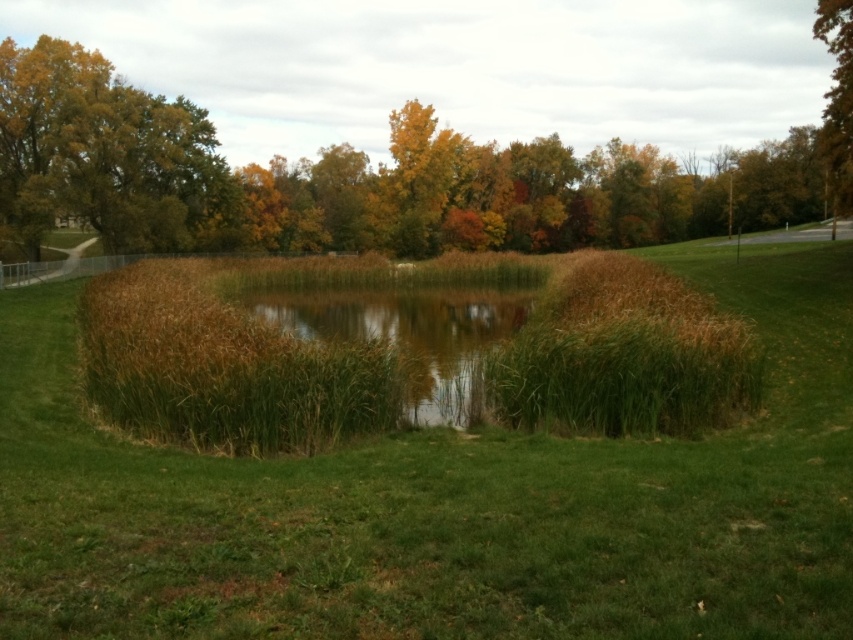
This screenshot has width=853, height=640. Identify the location of green grassy golf course at center. (445, 502).

Can you confirm if green grassy golf course at center is shorter than brown grassy lake at center?

Indeed, green grassy golf course at center has a lesser height compared to brown grassy lake at center.

Where is `green grassy golf course at center`? The height and width of the screenshot is (640, 853). green grassy golf course at center is located at coordinates (445, 502).

Which is more to the right, green leafy tree at upper center or green leafy tree at upper left?

Positioned to the right is green leafy tree at upper center.

This screenshot has height=640, width=853. I want to click on green leafy tree at upper center, so tap(352, 179).

Does point (816, 211) come behind point (171, 134)?

Yes, it is.

At what (x,y) coordinates should I click in order to perform the action: click on green leafy tree at upper center. Please return your answer as a coordinate pair (x, y). This screenshot has height=640, width=853. Looking at the image, I should click on (352, 179).

Who is taller, green leafy tree at upper left or brown grassy lake at center?

With more height is green leafy tree at upper left.

Where is `green leafy tree at upper left`? The width and height of the screenshot is (853, 640). green leafy tree at upper left is located at coordinates (102, 154).

Locate an element on the screen. The image size is (853, 640). green leafy tree at upper left is located at coordinates (102, 154).